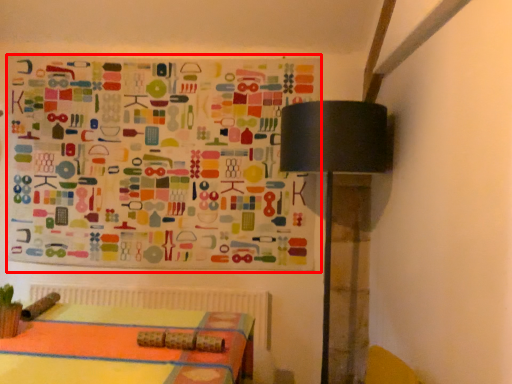
Question: In this image, where is bulletin board (annotated by the red box) located relative to table lamp?

Choices:
 (A) left
 (B) right

Answer: (A)